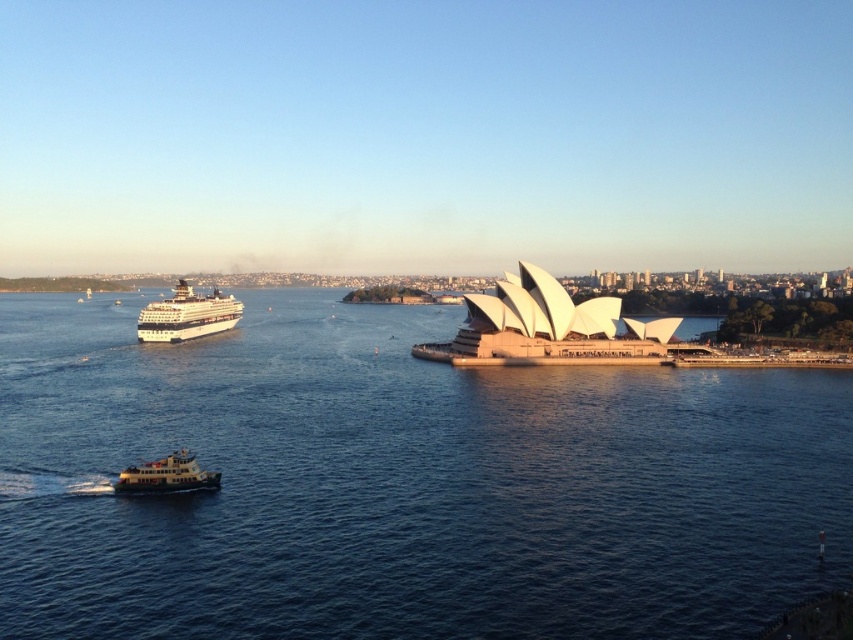
Is blue water at center bigger than white glossy cruise ship at left?

Yes, blue water at center is bigger than white glossy cruise ship at left.

Can you confirm if blue water at center is positioned above white glossy cruise ship at left?

Incorrect, blue water at center is not positioned above white glossy cruise ship at left.

You are a GUI agent. You are given a task and a screenshot of the screen. Output one action in this format:
    pyautogui.click(x=<x>, y=<y>)
    Task: Click on the blue water at center
    Image resolution: width=853 pixels, height=640 pixels.
    Given the screenshot: What is the action you would take?
    pyautogui.click(x=401, y=483)

Who is more forward, (180, 317) or (165, 486)?

Point (165, 486)

Who is more distant from viewer, (221, 330) or (131, 481)?

The point (221, 330) is behind.

Where is `white glossy cruise ship at left`? white glossy cruise ship at left is located at coordinates (187, 316).

Does blue water at center have a smaller size compared to white matte ferry at lower left?

No, blue water at center is not smaller than white matte ferry at lower left.

This screenshot has width=853, height=640. Describe the element at coordinates (401, 483) in the screenshot. I see `blue water at center` at that location.

Does point (271, 524) come in front of point (129, 484)?

Yes.

You are a GUI agent. You are given a task and a screenshot of the screen. Output one action in this format:
    pyautogui.click(x=<x>, y=<y>)
    Task: Click on the blue water at center
    
    Given the screenshot: What is the action you would take?
    pyautogui.click(x=401, y=483)